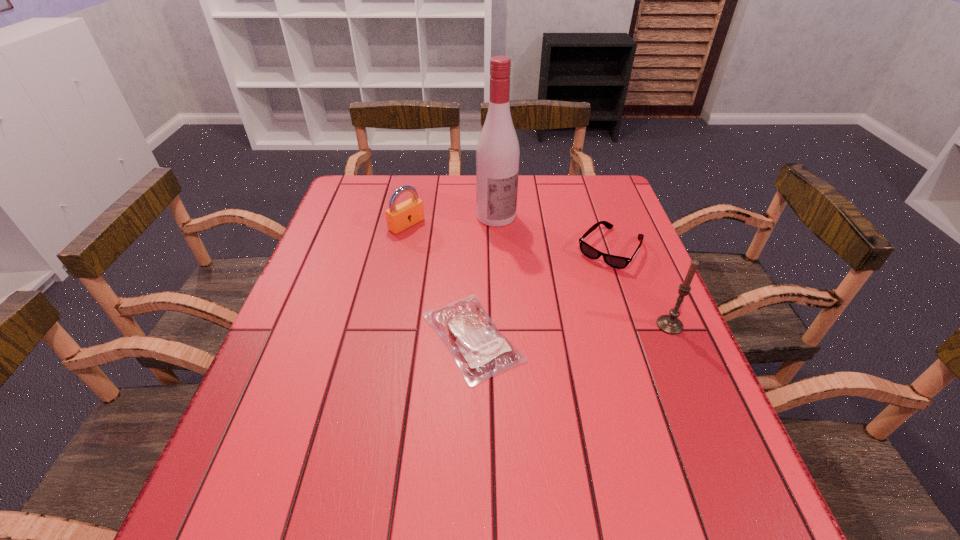
This screenshot has height=540, width=960. In order to click on vacant space located 0.380m on the front-facing side of the sunglasses in this screenshot , I will do `click(519, 365)`.

In order to click on vacant space located 0.210m to unlock the padlock from the front in this screenshot , I will do `click(468, 265)`.

Identify the location of free spot located 0.190m to unlock the padlock from the front. Image resolution: width=960 pixels, height=540 pixels. (464, 262).

Locate an element on the screen. The image size is (960, 540). vacant space situated 0.310m to unlock the padlock from the front is located at coordinates (496, 284).

Image resolution: width=960 pixels, height=540 pixels. In order to click on free spot located on the label of the tallest object in this screenshot , I will do `click(522, 246)`.

Find the location of a particular element. free space located on the label of the tallest object is located at coordinates (586, 318).

This screenshot has height=540, width=960. Find the location of `vacant area situated 0.130m on the label of the tallest object`. vacant area situated 0.130m on the label of the tallest object is located at coordinates (527, 252).

Image resolution: width=960 pixels, height=540 pixels. In order to click on padlock that is positioned at the far edge in this screenshot , I will do `click(399, 217)`.

The height and width of the screenshot is (540, 960). In order to click on alcohol at the far edge in this screenshot , I will do `click(497, 154)`.

Find the location of a particular element. The image size is (960, 540). candle situated at the right edge is located at coordinates (670, 324).